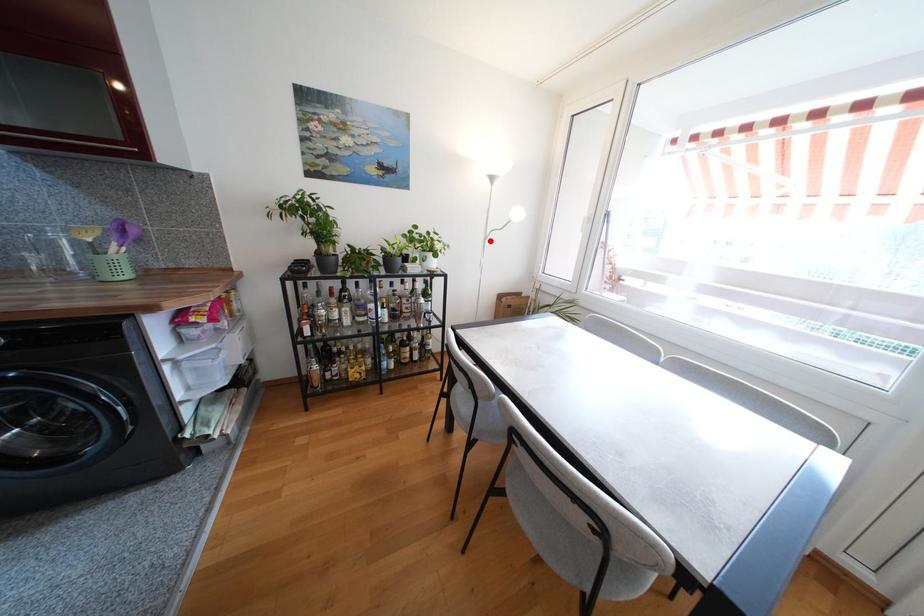
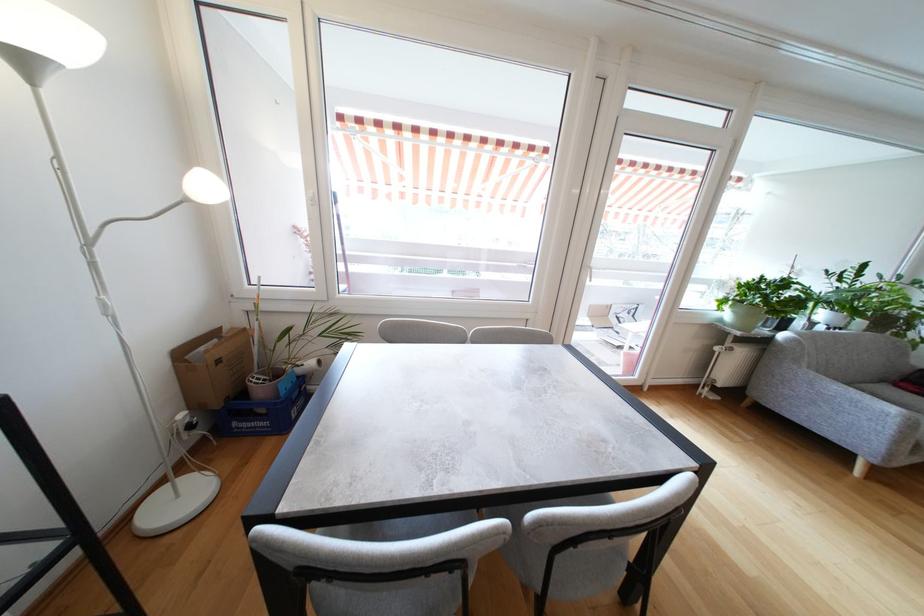
Where in the second image is the point corresponding to the highlighted location from the first image?

(93, 246)